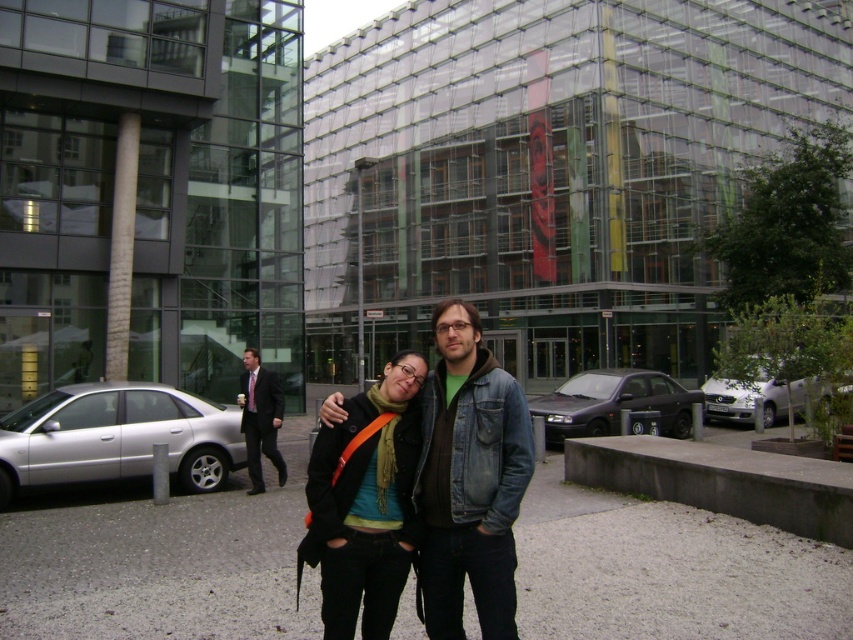
Question: Does silver metallic car at left have a larger size compared to dark gray metallic sedan at center-right?

Choices:
 (A) no
 (B) yes

Answer: (B)

Question: Which of the following is the closest to the observer?

Choices:
 (A) dark gray metallic sedan at center-right
 (B) black suit at left
 (C) white metallic car at right
 (D) silver metallic car at left

Answer: (D)

Question: Which of the following is the closest to the observer?

Choices:
 (A) white metallic car at right
 (B) silver metallic car at left
 (C) dark gray metallic sedan at center-right
 (D) denim jacket at center

Answer: (D)

Question: Does silver metallic car at left appear under white metallic car at right?

Choices:
 (A) no
 (B) yes

Answer: (B)

Question: Which object is positioned farthest from the black suit at left?

Choices:
 (A) white metallic car at right
 (B) denim jacket at center
 (C) matte black jacket at center
 (D) dark gray metallic sedan at center-right

Answer: (A)

Question: Is white metallic car at right below black suit at left?

Choices:
 (A) yes
 (B) no

Answer: (A)